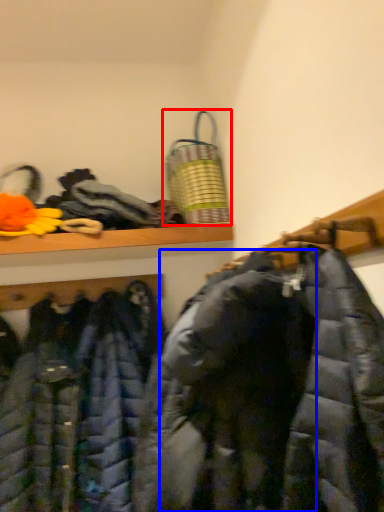
Question: Which object is closer to the camera taking this photo, laundry basket (highlighted by a red box) or cloak (highlighted by a blue box)?

Choices:
 (A) laundry basket
 (B) cloak

Answer: (B)